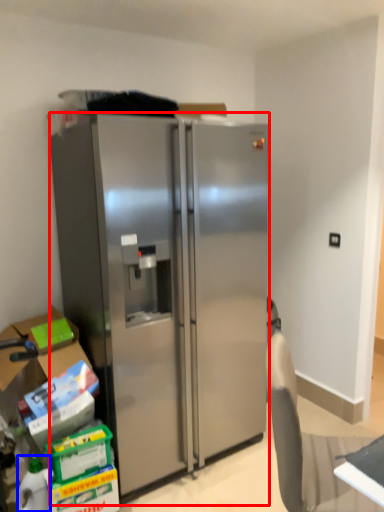
Question: Which object appears closest to the camera in this image, refrigerator (highlighted by a red box) or bottle (highlighted by a blue box)?

Choices:
 (A) refrigerator
 (B) bottle

Answer: (A)